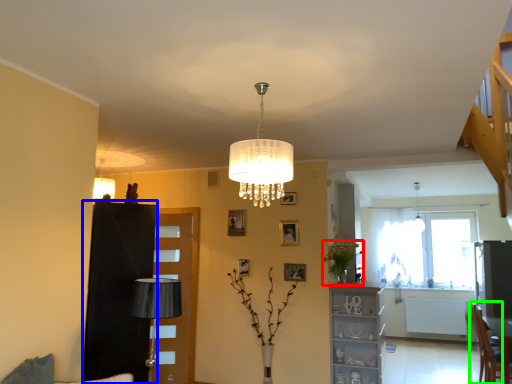
Question: Based on their relative distances, which object is nearer to plant (highlighted by a red box)? Choose from dresser (highlighted by a blue box) and armchair (highlighted by a green box).

Choices:
 (A) dresser
 (B) armchair

Answer: (B)